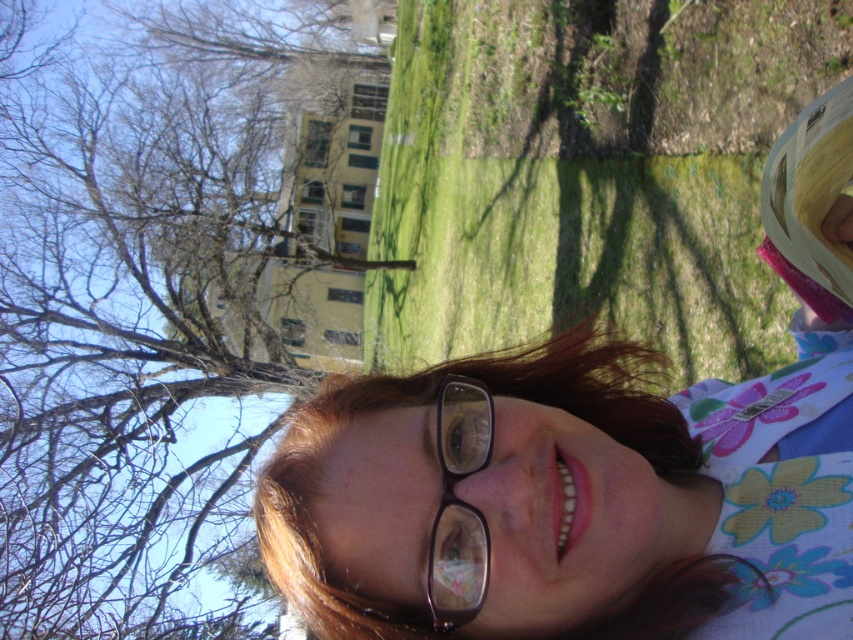
Question: In this image, where is bare branches at upper left located relative to black plastic glasses at center?

Choices:
 (A) right
 (B) left

Answer: (B)

Question: Which point is closer to the camera taking this photo?

Choices:
 (A) (469, 508)
 (B) (376, 20)
 (C) (709, 592)

Answer: (A)

Question: Does bare branches at upper left have a larger size compared to matte black glasses at center?

Choices:
 (A) yes
 (B) no

Answer: (A)

Question: Which point is farther to the camera?

Choices:
 (A) (456, 589)
 (B) (836, 520)
 (C) (143, 499)

Answer: (C)

Question: Does bare branches at upper left lie in front of matte black glasses at center?

Choices:
 (A) yes
 (B) no

Answer: (B)

Question: Which object is the closest to the matte black glasses at center?

Choices:
 (A) black plastic glasses at center
 (B) bare branches at upper left

Answer: (A)